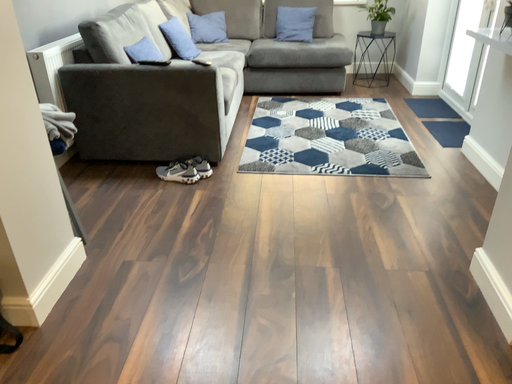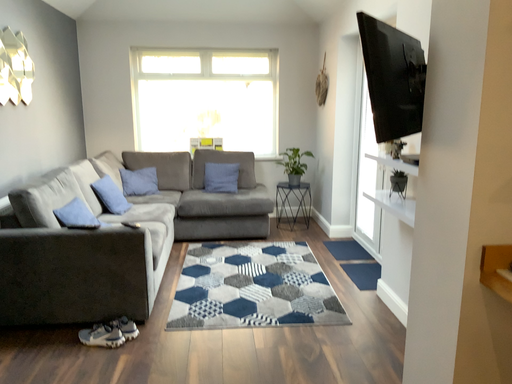
Question: How did the camera likely rotate when shooting the video?

Choices:
 (A) rotated upward
 (B) rotated downward

Answer: (A)